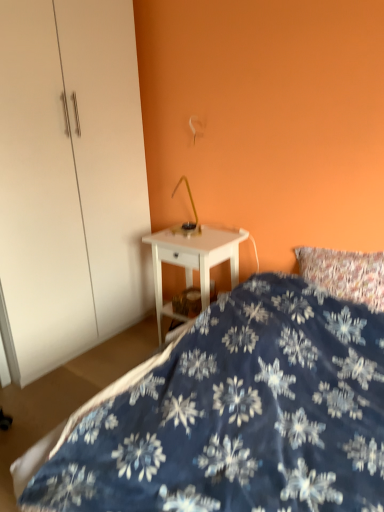
At what (x,y) coordinates should I click in order to perform the action: click on white glossy dresser at center. Please return your answer as a coordinate pair (x, y). This screenshot has width=384, height=512. Looking at the image, I should click on (70, 181).

The height and width of the screenshot is (512, 384). What do you see at coordinates (193, 260) in the screenshot?
I see `white glossy nightstand at center` at bounding box center [193, 260].

I want to click on white glossy dresser at center, so click(70, 181).

Which is behind, white glossy dresser at center or white glossy nightstand at center?

white glossy nightstand at center is further from the camera.

Considering the sizes of objects white glossy dresser at center and white glossy nightstand at center in the image provided, who is thinner, white glossy dresser at center or white glossy nightstand at center?

white glossy nightstand at center is thinner.

Is white glossy dresser at center to the left of white glossy nightstand at center from the viewer's perspective?

Correct, you'll find white glossy dresser at center to the left of white glossy nightstand at center.

Could you tell me if white glossy dresser at center is turned towards white glossy nightstand at center?

Yes, white glossy dresser at center is aimed at white glossy nightstand at center.

Between point (192, 507) and point (157, 292), which one is positioned in front?

The point (192, 507) is closer.

Can you confirm if blue fabric bed at lower right is taller than white glossy nightstand at center?

No, blue fabric bed at lower right is not taller than white glossy nightstand at center.

Is blue fabric bed at lower right wider or thinner than white glossy nightstand at center?

Considering their sizes, blue fabric bed at lower right looks broader than white glossy nightstand at center.

Image resolution: width=384 pixels, height=512 pixels. In the image, there is a white glossy nightstand at center. In order to click on bed below it (from a real-world perspective) in this screenshot , I will do `click(236, 414)`.

Which of these two, white glossy dresser at center or blue fabric bed at lower right, is smaller?

With smaller size is blue fabric bed at lower right.

Can you confirm if white glossy dresser at center is thinner than blue fabric bed at lower right?

Indeed, white glossy dresser at center has a lesser width compared to blue fabric bed at lower right.

Is point (115, 200) closer to viewer compared to point (368, 412)?

No, (115, 200) is further to viewer.

Considering the relative sizes of blue fabric bed at lower right and white glossy dresser at center in the image provided, is blue fabric bed at lower right shorter than white glossy dresser at center?

Indeed, blue fabric bed at lower right has a lesser height compared to white glossy dresser at center.

From a real-world perspective, between blue fabric bed at lower right and white glossy dresser at center, who is vertically higher?

white glossy dresser at center, from a real-world perspective.

Image resolution: width=384 pixels, height=512 pixels. There is a blue fabric bed at lower right. In order to click on dresser above it (from a real-world perspective) in this screenshot , I will do `click(70, 181)`.

Considering the positions of objects blue fabric bed at lower right and white glossy dresser at center in the image provided, who is behind, blue fabric bed at lower right or white glossy dresser at center?

Positioned behind is white glossy dresser at center.

From a real-world perspective, between white glossy nightstand at center and blue fabric bed at lower right, who is vertically lower?

From a 3D spatial view, blue fabric bed at lower right is below.

Where is `nightstand above the blue fabric bed at lower right (from a real-world perspective)`? The width and height of the screenshot is (384, 512). nightstand above the blue fabric bed at lower right (from a real-world perspective) is located at coordinates click(193, 260).

Which of these two, white glossy nightstand at center or blue fabric bed at lower right, stands shorter?

With less height is blue fabric bed at lower right.

Considering the relative positions of white glossy nightstand at center and blue fabric bed at lower right in the image provided, is white glossy nightstand at center to the left of blue fabric bed at lower right from the viewer's perspective?

Indeed, white glossy nightstand at center is positioned on the left side of blue fabric bed at lower right.

From a real-world perspective, which is physically below, white glossy nightstand at center or white glossy dresser at center?

In real-world perspective, white glossy nightstand at center is lower.

From the image's perspective, which object appears higher, white glossy nightstand at center or white glossy dresser at center?

white glossy dresser at center, from the image's perspective.

Between point (237, 274) and point (73, 225), which one is positioned in front?

Positioned in front is point (73, 225).

Based on the photo, does white glossy nightstand at center have a lesser height compared to white glossy dresser at center?

Yes.

Locate an element on the screen. nightstand below the white glossy dresser at center (from a real-world perspective) is located at coordinates (193, 260).

Where is `bed lying below the white glossy nightstand at center (from the image's perspective)`? The image size is (384, 512). bed lying below the white glossy nightstand at center (from the image's perspective) is located at coordinates (236, 414).

Based on their spatial positions, is white glossy dresser at center or blue fabric bed at lower right further from white glossy nightstand at center?

Among the two, blue fabric bed at lower right is located further to white glossy nightstand at center.

From the image, which object appears to be nearer to white glossy dresser at center, blue fabric bed at lower right or white glossy nightstand at center?

The object closer to white glossy dresser at center is white glossy nightstand at center.

From the image, which object appears to be nearer to white glossy dresser at center, white glossy nightstand at center or blue fabric bed at lower right?

white glossy nightstand at center is closer to white glossy dresser at center.

Estimate the real-world distances between objects in this image. Which object is further from blue fabric bed at lower right, white glossy nightstand at center or white glossy dresser at center?

white glossy dresser at center.

Based on their spatial positions, is white glossy dresser at center or white glossy nightstand at center further from blue fabric bed at lower right?

white glossy dresser at center is further to blue fabric bed at lower right.

Which object lies further to the anchor point white glossy nightstand at center, blue fabric bed at lower right or white glossy dresser at center?

Among the two, blue fabric bed at lower right is located further to white glossy nightstand at center.

The image size is (384, 512). In order to click on dresser located between blue fabric bed at lower right and white glossy nightstand at center in the depth direction in this screenshot , I will do `click(70, 181)`.